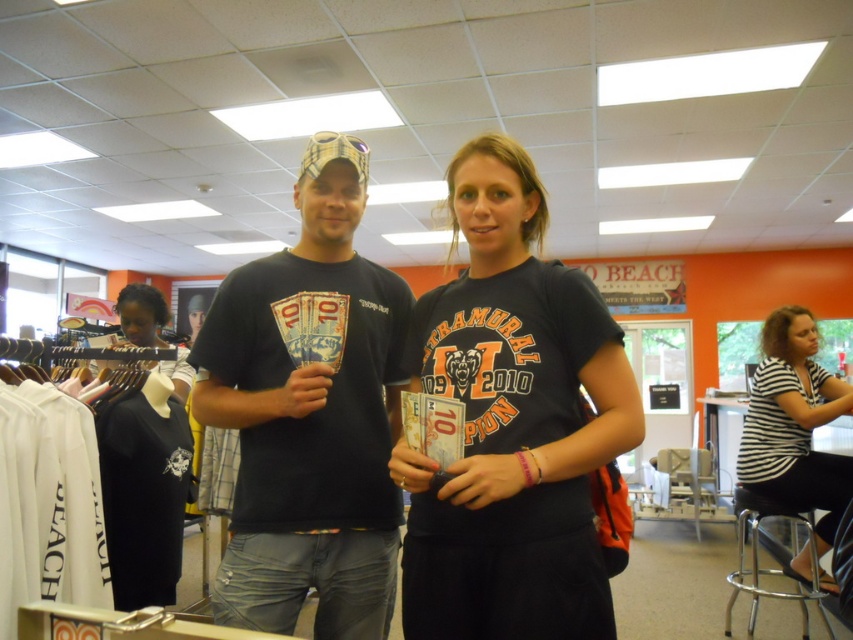
Question: Which point is closer to the camera taking this photo?

Choices:
 (A) (775, 593)
 (B) (558, 486)
 (C) (328, 141)
 (D) (795, 442)

Answer: (B)

Question: Considering the relative positions of black matte t-shirt at center and striped cotton shirt at center in the image provided, where is black matte t-shirt at center located with respect to striped cotton shirt at center?

Choices:
 (A) left
 (B) right

Answer: (A)

Question: Which object is farther from the camera taking this photo?

Choices:
 (A) striped cotton shirt at center
 (B) black matte t-shirt at center
 (C) black cotton t-shirt at center
 (D) clear plastic stool at lower right

Answer: (D)

Question: In this image, where is black cotton t-shirt at center located relative to striped cotton shirt at center?

Choices:
 (A) above
 (B) below

Answer: (A)

Question: Which point appears closest to the camera in this image?

Choices:
 (A) (798, 586)
 (B) (836, 408)
 (C) (508, 637)
 (D) (401, 296)

Answer: (C)

Question: Where is black cotton t-shirt at center located in relation to black matte t-shirt at center in the image?

Choices:
 (A) right
 (B) left

Answer: (A)